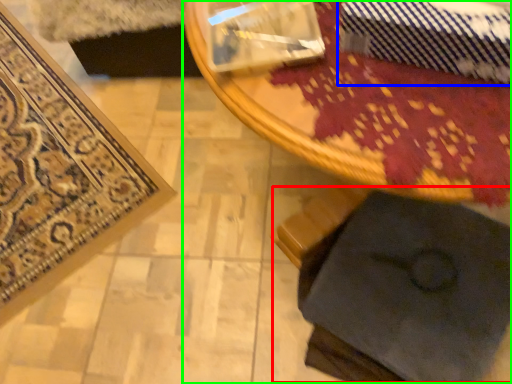
Question: Considering the real-world distances, which object is farthest from swivel chair (highlighted by a red box)? tie (highlighted by a blue box) or table (highlighted by a green box)?

Choices:
 (A) tie
 (B) table

Answer: (A)